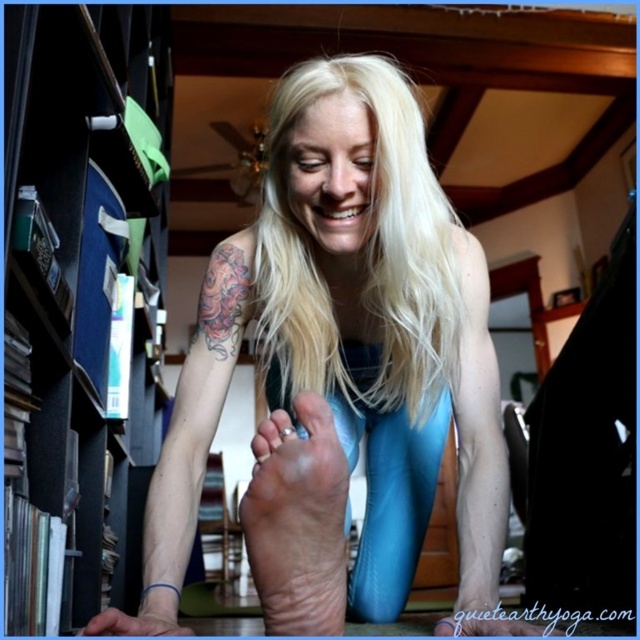
Based on the scene description, where is the blonde silky hair at center located in terms of its 2D coordinates?

The blonde silky hair at center is located at the 2D coordinates point (x=364, y=253).

You are a photographer adjusting your camera to capture the scene. You notice the black cardboard bookshelf at left and the matte blue toe at lower center. Which object should you focus on first if you want to ensure both are in sharp focus?

You should focus on the black cardboard bookshelf at left first because it is farther away from the matte blue toe at lower center, ensuring both will be in focus when the camera adjusts depth of field.

You are standing in the room where the person is practicing yoga. You want to place a small plant on the bookshelf. Can you reach the black cardboard bookshelf at left from your current position?

The position of black cardboard bookshelf at left is at point (74, 292), so yes, you can reach it from your current position in the room.